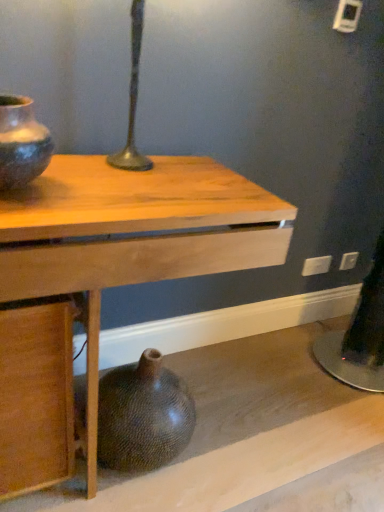
Where is `vacant space situated above wooden table at center (from a real-world perspective)`? vacant space situated above wooden table at center (from a real-world perspective) is located at coordinates (x=125, y=182).